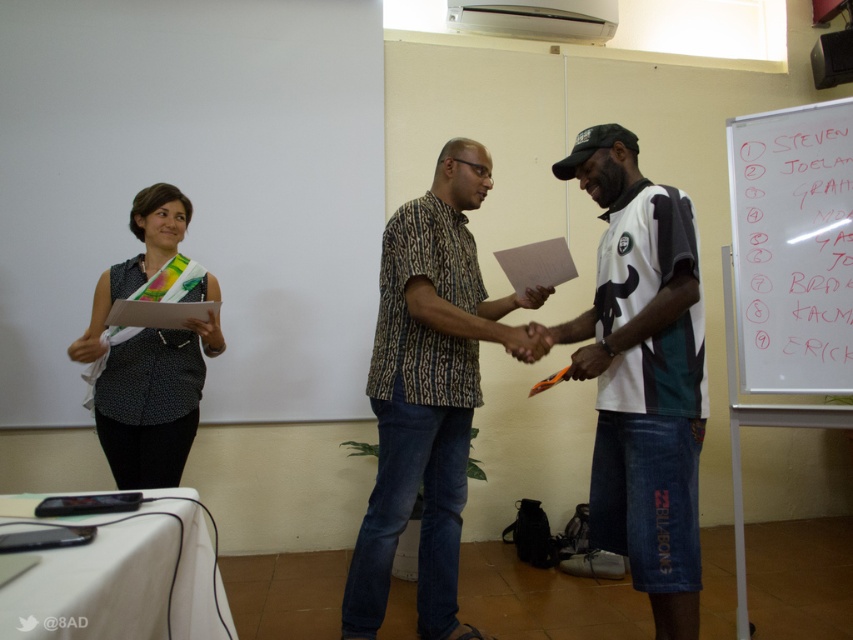
You are observing a ceremony where two men are shaking hands. You see the white jersey at center and the black dotted shirt at left. Which one is closer to you?

The white jersey at center is closer to you because it is in front of the black dotted shirt at left.

You are standing in the conference room and see the patterned fabric shirt at center. Can you estimate its location in terms of coordinates?

The patterned fabric shirt at center is located at coordinates point (428, 392).